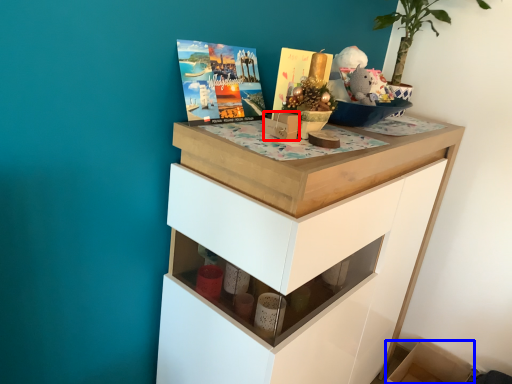
Question: Among these objects, which one is nearest to the camera, box (highlighted by a red box) or cabinetry (highlighted by a blue box)?

Choices:
 (A) box
 (B) cabinetry

Answer: (A)